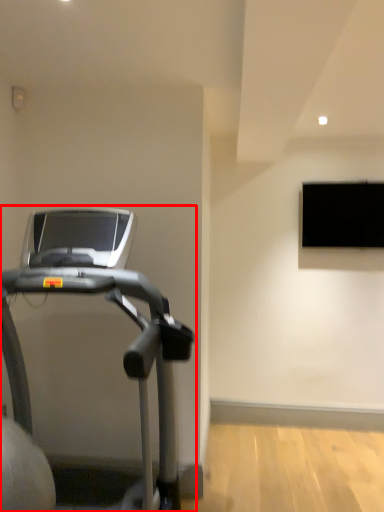
Question: From the image's perspective, considering the relative positions of treadmill (annotated by the red box) and window in the image provided, where is treadmill (annotated by the red box) located with respect to the staircase?

Choices:
 (A) above
 (B) below

Answer: (B)